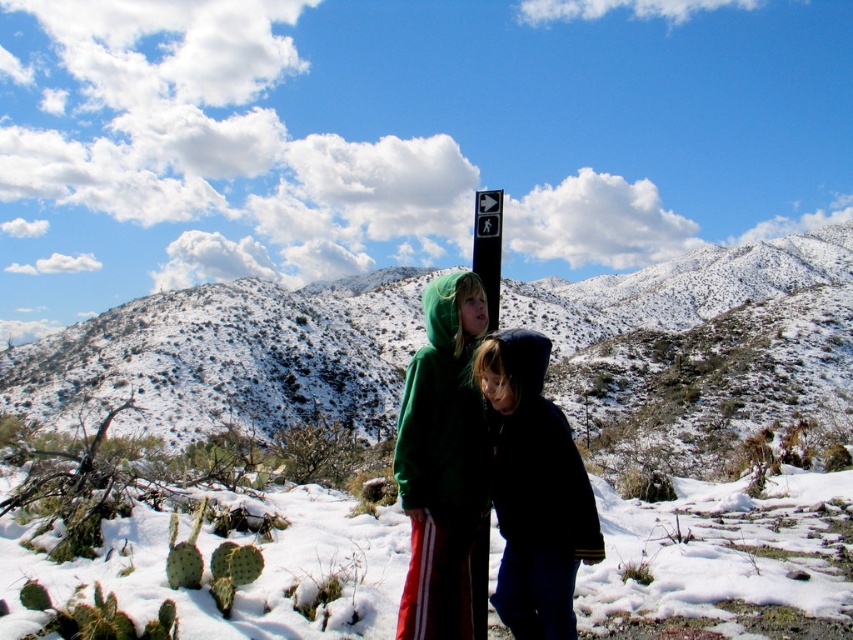
Which is above, snowy rocky mountain at center or green fleece jackets at center?

Positioned higher is snowy rocky mountain at center.

Who is more distant from viewer, (715, 292) or (396, 467)?

Point (715, 292)

Locate an element on the screen. The width and height of the screenshot is (853, 640). snowy rocky mountain at center is located at coordinates (227, 358).

From the picture: Who is shorter, snowy rocky mountain at center or black plastic sign at upper center?

With less height is black plastic sign at upper center.

Does snowy rocky mountain at center have a greater width compared to black plastic sign at upper center?

Yes, snowy rocky mountain at center is wider than black plastic sign at upper center.

Find the location of a particular element. Image resolution: width=853 pixels, height=640 pixels. snowy rocky mountain at center is located at coordinates (227, 358).

Between green fleece jackets at center and black plastic sign at upper center, which one appears on the right side from the viewer's perspective?

Positioned to the right is black plastic sign at upper center.

Can you confirm if green fleece jackets at center is positioned above black plastic sign at upper center?

No, green fleece jackets at center is not above black plastic sign at upper center.

You are a GUI agent. You are given a task and a screenshot of the screen. Output one action in this format:
    pyautogui.click(x=<x>, y=<y>)
    Task: Click on the green fleece jackets at center
    
    Given the screenshot: What is the action you would take?
    pyautogui.click(x=444, y=464)